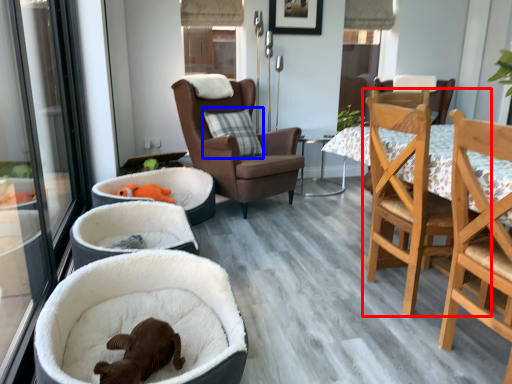
Question: Which of the following is the closest to the observer, chair (highlighted by a red box) or pillow (highlighted by a blue box)?

Choices:
 (A) chair
 (B) pillow

Answer: (A)